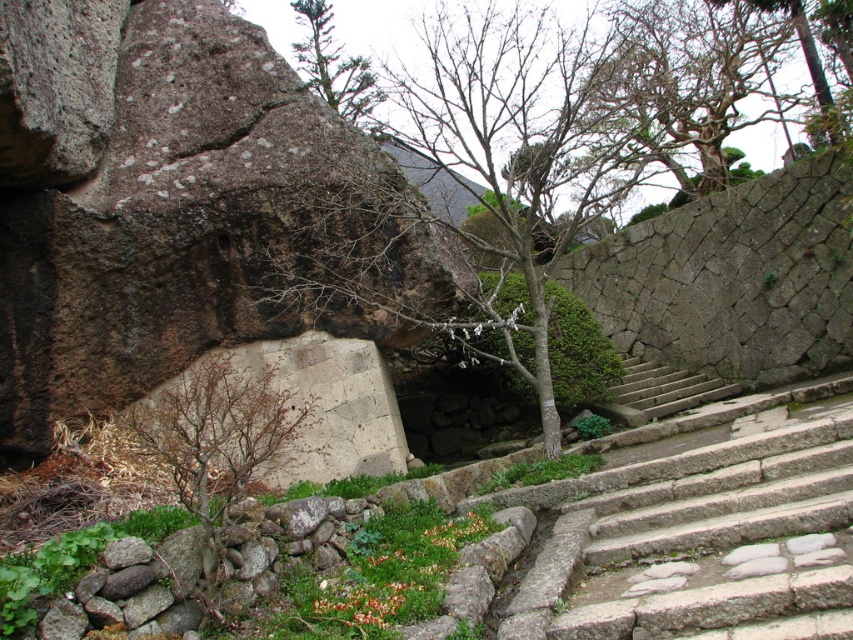
Is point (788, 182) positioned after point (718, 392)?

No, (788, 182) is in front of (718, 392).

Can you confirm if green leafy tree at center is taller than gray stone stairs at center?

Indeed, green leafy tree at center has a greater height compared to gray stone stairs at center.

Who is more forward, (837, 337) or (718, 396)?

Point (837, 337) is in front.

Locate an element on the screen. green leafy tree at center is located at coordinates (733, 280).

Is brown textured tree at lower left wider than gray stone stairs at center?

No, brown textured tree at lower left is not wider than gray stone stairs at center.

Which is below, brown textured tree at lower left or gray stone stairs at center?

gray stone stairs at center is lower down.

Describe the element at coordinates (216, 436) in the screenshot. The height and width of the screenshot is (640, 853). I see `brown textured tree at lower left` at that location.

Locate an element on the screen. brown textured tree at lower left is located at coordinates (216, 436).

Is green leafy tree at center to the right of green leafy tree at upper center from the viewer's perspective?

Yes, green leafy tree at center is to the right of green leafy tree at upper center.

The image size is (853, 640). What are the coordinates of `green leafy tree at center` in the screenshot? It's located at (733, 280).

Where is `green leafy tree at center`? The height and width of the screenshot is (640, 853). green leafy tree at center is located at coordinates (733, 280).

Where is `green leafy tree at center`? The height and width of the screenshot is (640, 853). green leafy tree at center is located at coordinates (733, 280).